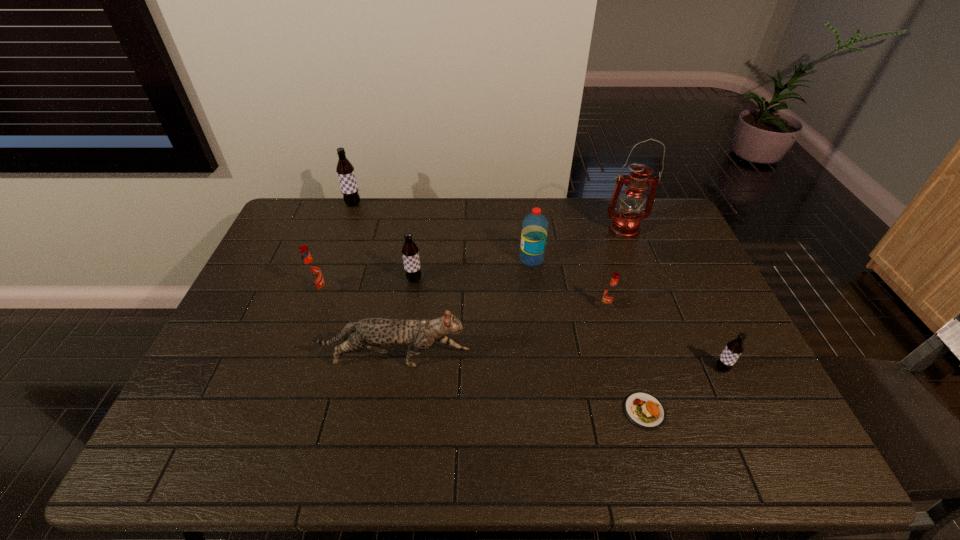
Find the location of a particular element. This screenshot has height=540, width=960. vacant space that is in between the fifth object from left to right and the biggest brown root beer is located at coordinates (443, 232).

Where is `vacant space that's between the third root beer from right to left and the oil lamp`? The image size is (960, 540). vacant space that's between the third root beer from right to left and the oil lamp is located at coordinates (518, 255).

This screenshot has width=960, height=540. In order to click on free space that is in between the second smallest brown root beer and the cat in this screenshot , I will do `click(404, 320)`.

Locate an element on the screen. The image size is (960, 540). vacant point located between the second biggest brown root beer and the red oil lamp is located at coordinates (518, 255).

The width and height of the screenshot is (960, 540). I want to click on free spot between the fifth farthest object and the red oil lamp, so click(x=471, y=261).

Find the location of `vacant area that lies between the leftmost brown root beer and the cat`. vacant area that lies between the leftmost brown root beer and the cat is located at coordinates (373, 282).

Where is `free space between the oil lamp and the cat`? The image size is (960, 540). free space between the oil lamp and the cat is located at coordinates (509, 295).

Locate an element on the screen. vacant space that is in between the farthest object and the cat is located at coordinates (373, 282).

Image resolution: width=960 pixels, height=540 pixels. I want to click on vacant area that lies between the eighth nearest object and the rightmost object, so click(673, 299).

Locate an element on the screen. vacant point located between the cat and the shortest object is located at coordinates (519, 385).